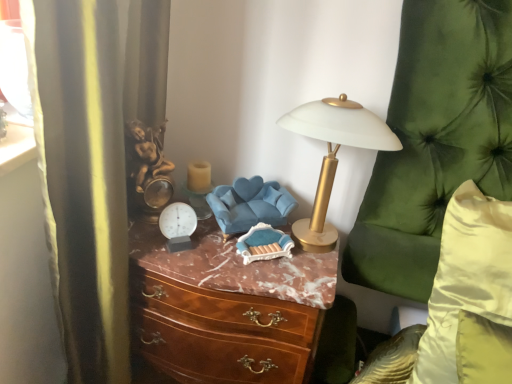
Identify the location of vacant space in front of blue fabric swivel chair at center. (242, 273).